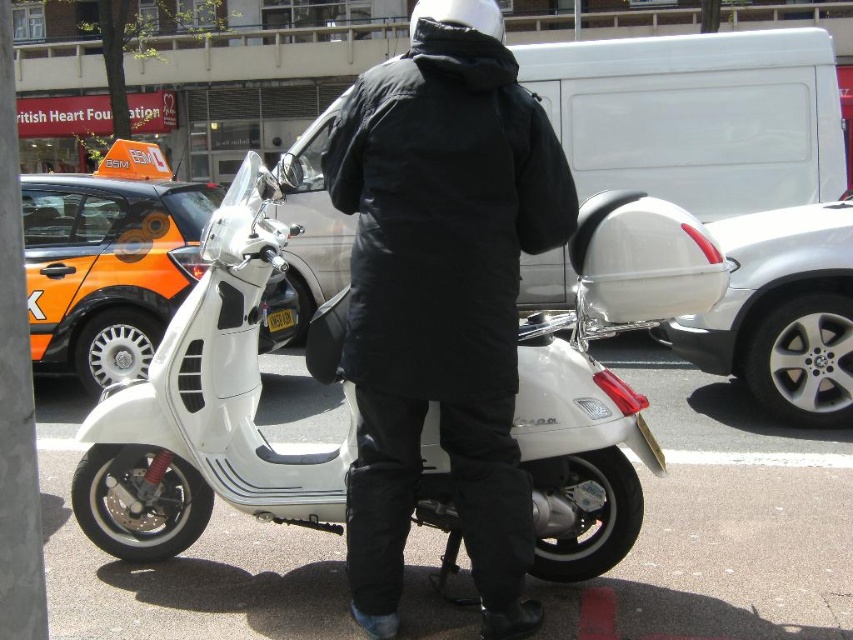
From the picture: You are a delivery person who needs to load a package onto the scooter. The package requires a flat surface area on the scooter. Which object, the white matte scooter at center or the black matte jacket at center, has a flat surface suitable for placing the package?

The white matte scooter at center has a flat surface suitable for placing the package because it is positioned on the left side of the black matte jacket at center, indicating it has space available for the package.